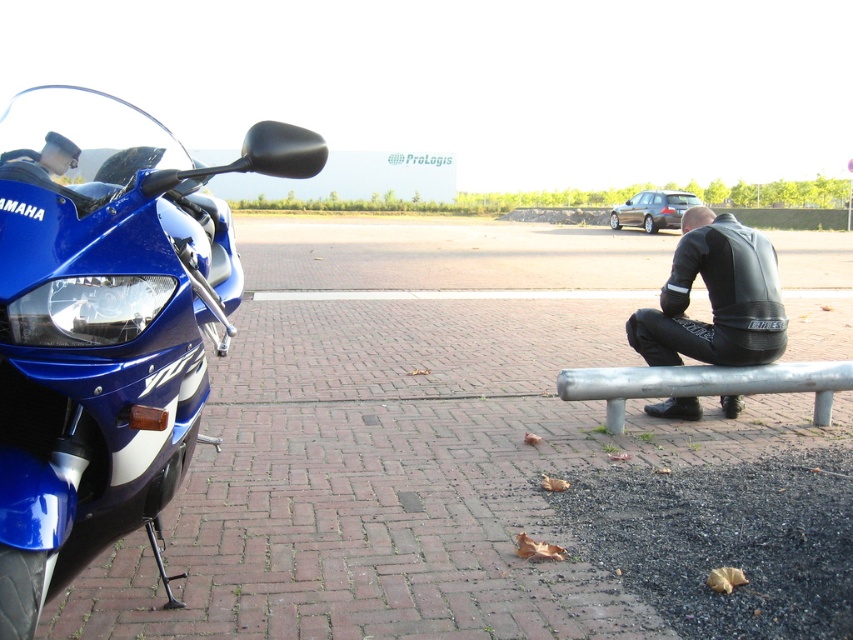
You are standing at the edge of the parking lot and see the brick pavement at lower left and the blue glossy motorcycle at left. Which object is positioned more to the right from your viewpoint?

The brick pavement at lower left is positioned to the right of the blue glossy motorcycle at left, so the brick pavement at lower left is more to the right.